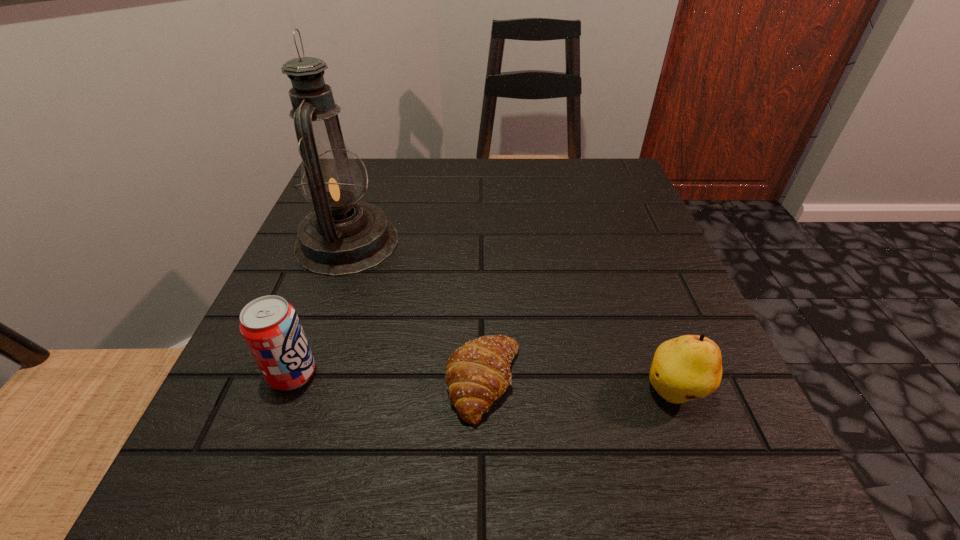
Locate an element on the screen. oil lamp is located at coordinates (342, 236).

Identify the location of the farthest object. (342, 236).

The width and height of the screenshot is (960, 540). Identify the location of soda can. coord(270,326).

I want to click on the second shortest object, so click(689, 367).

You are a GUI agent. You are given a task and a screenshot of the screen. Output one action in this format:
    pyautogui.click(x=<x>, y=<y>)
    Task: Click on the pear
    This screenshot has width=960, height=540.
    Given the screenshot: What is the action you would take?
    pyautogui.click(x=689, y=367)

This screenshot has width=960, height=540. In order to click on crescent roll in this screenshot , I will do `click(478, 373)`.

Find the location of `the shortest object`. the shortest object is located at coordinates (478, 373).

You are a GUI agent. You are given a task and a screenshot of the screen. Output one action in this format:
    pyautogui.click(x=<x>, y=<y>)
    Task: Click on the vacant area located 0.240m on the back of the tallest object
    This screenshot has height=540, width=960.
    Given the screenshot: What is the action you would take?
    pyautogui.click(x=377, y=160)

The width and height of the screenshot is (960, 540). Find the location of `vacant space located 0.370m on the back of the soda can`. vacant space located 0.370m on the back of the soda can is located at coordinates (352, 215).

Identify the location of vacant space located 0.120m on the front of the rightmost object. (722, 515).